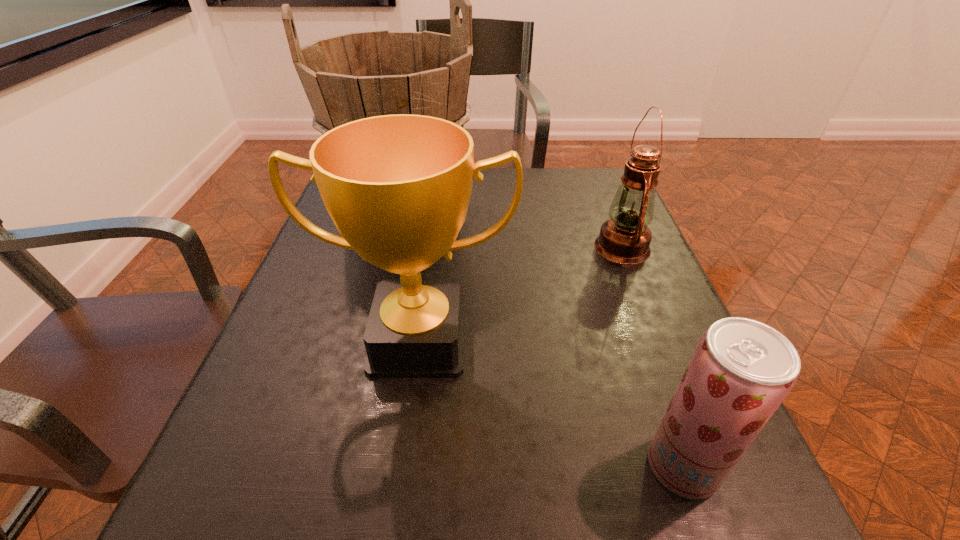
You are a GUI agent. You are given a task and a screenshot of the screen. Output one action in this format:
    pyautogui.click(x=<x>, y=<y>)
    Task: Click on the object located in the near edge section of the desktop
    This screenshot has width=960, height=540.
    Given the screenshot: What is the action you would take?
    pyautogui.click(x=741, y=371)

Locate an element on the screen. Image resolution: width=960 pixels, height=540 pixels. bucket present at the left edge is located at coordinates (352, 76).

Where is `award present at the left edge`? This screenshot has height=540, width=960. award present at the left edge is located at coordinates (397, 187).

Find the location of a particular element. The image size is (960, 540). oil lamp that is at the right edge is located at coordinates (625, 238).

Where is `fruit juice that is positioned at the right edge`? Image resolution: width=960 pixels, height=540 pixels. fruit juice that is positioned at the right edge is located at coordinates (741, 371).

Where is `object at the far left corner`? This screenshot has height=540, width=960. object at the far left corner is located at coordinates (352, 76).

In order to click on object that is at the near right corner in this screenshot , I will do `click(741, 371)`.

Locate an element on the screen. vacant space at the far edge is located at coordinates (525, 204).

Identify the location of free space at the left edge of the desktop. (337, 312).

This screenshot has width=960, height=540. In the image, there is a desktop. What are the coordinates of `vacant space at the right edge` in the screenshot? It's located at (669, 370).